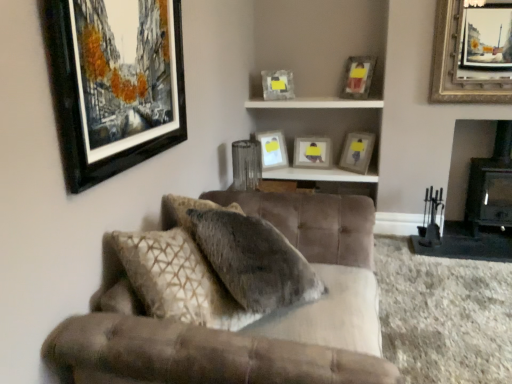
Question: Are matte glass picture frame at upper center, acting as the 5th picture frame starting from the front, and black matte picture frame at upper left, which is the seventh picture frame in right-to-left order, beside each other?

Choices:
 (A) yes
 (B) no

Answer: (B)

Question: From a real-world perspective, does matte glass picture frame at upper center, acting as the 5th picture frame starting from the front, sit lower than black matte picture frame at upper left, the seventh picture frame viewed from the back?

Choices:
 (A) yes
 (B) no

Answer: (A)

Question: Is the depth of matte glass picture frame at upper center, marked as the 3th picture frame in a left-to-right arrangement, greater than that of black matte picture frame at upper left, arranged as the first picture frame when viewed from the front?

Choices:
 (A) no
 (B) yes

Answer: (B)

Question: Considering the relative sizes of matte glass picture frame at upper center, which is the 3th picture frame from back to front, and black matte picture frame at upper left, which is the seventh picture frame in right-to-left order, in the image provided, is matte glass picture frame at upper center, which is the 3th picture frame from back to front, wider than black matte picture frame at upper left, which is the seventh picture frame in right-to-left order,?

Choices:
 (A) no
 (B) yes

Answer: (B)

Question: Does matte glass picture frame at upper center, which is the 3th picture frame from back to front, have a larger size compared to black matte picture frame at upper left, which is the seventh picture frame in right-to-left order?

Choices:
 (A) yes
 (B) no

Answer: (B)

Question: Considering the relative positions of matte wooden picture frame at upper right, acting as the 5th picture frame starting from the left, and wooden shelf at upper center in the image provided, is matte wooden picture frame at upper right, acting as the 5th picture frame starting from the left, to the left or to the right of wooden shelf at upper center?

Choices:
 (A) right
 (B) left

Answer: (A)

Question: In the image, is matte wooden picture frame at upper right, acting as the third picture frame starting from the front, positioned in front of or behind wooden shelf at upper center?

Choices:
 (A) front
 (B) behind

Answer: (A)

Question: In terms of width, does matte wooden picture frame at upper right, acting as the third picture frame starting from the front, look wider or thinner when compared to wooden shelf at upper center?

Choices:
 (A) wide
 (B) thin

Answer: (B)

Question: From a real-world perspective, is matte wooden picture frame at upper right, acting as the fifth picture frame starting from the back, positioned above or below wooden shelf at upper center?

Choices:
 (A) above
 (B) below

Answer: (A)

Question: Considering the positions of matte white picture frame at upper center, which is the sixth picture frame in right-to-left order, and black matte picture frame at upper left, placed as the 1th picture frame when sorted from left to right, in the image, is matte white picture frame at upper center, which is the sixth picture frame in right-to-left order, taller or shorter than black matte picture frame at upper left, placed as the 1th picture frame when sorted from left to right,?

Choices:
 (A) tall
 (B) short

Answer: (B)

Question: Is matte white picture frame at upper center, which is the sixth picture frame in right-to-left order, spatially inside black matte picture frame at upper left, which is the seventh picture frame in right-to-left order, or outside of it?

Choices:
 (A) inside
 (B) outside

Answer: (B)

Question: Relative to black matte picture frame at upper left, placed as the 1th picture frame when sorted from left to right, is matte white picture frame at upper center, acting as the sixth picture frame starting from the front, in front or behind?

Choices:
 (A) behind
 (B) front

Answer: (A)

Question: From the image's perspective, is matte white picture frame at upper center, the 2th picture frame viewed from the left, located above or below black matte picture frame at upper left, placed as the 1th picture frame when sorted from left to right?

Choices:
 (A) above
 (B) below

Answer: (B)

Question: Considering their positions, is matte gray picture frame at center, acting as the seventh picture frame starting from the front, located in front of or behind matte white picture frame at upper center, the 2th picture frame viewed from the left?

Choices:
 (A) behind
 (B) front

Answer: (A)

Question: Is matte gray picture frame at center, the fourth picture frame viewed from the right, bigger or smaller than matte white picture frame at upper center, acting as the sixth picture frame starting from the front?

Choices:
 (A) big
 (B) small

Answer: (A)